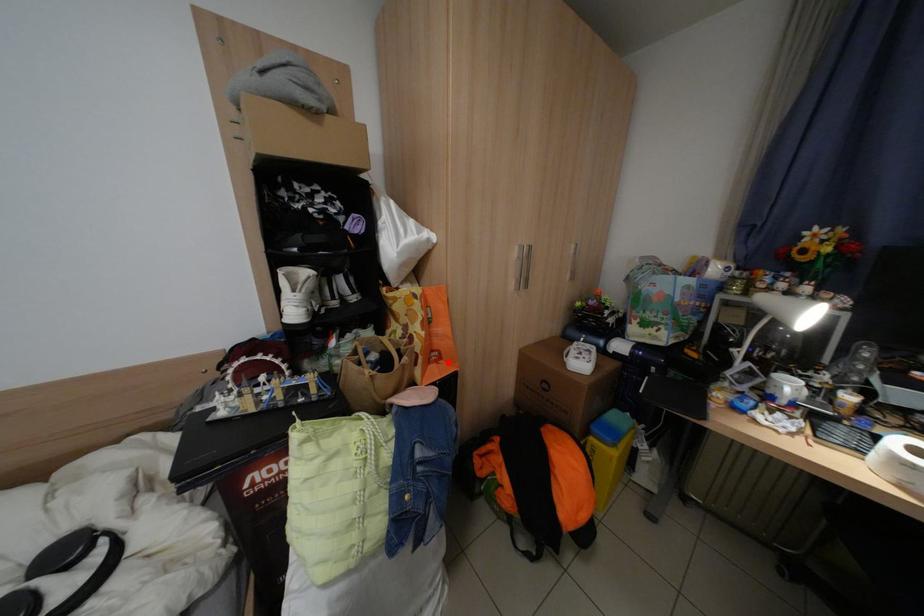
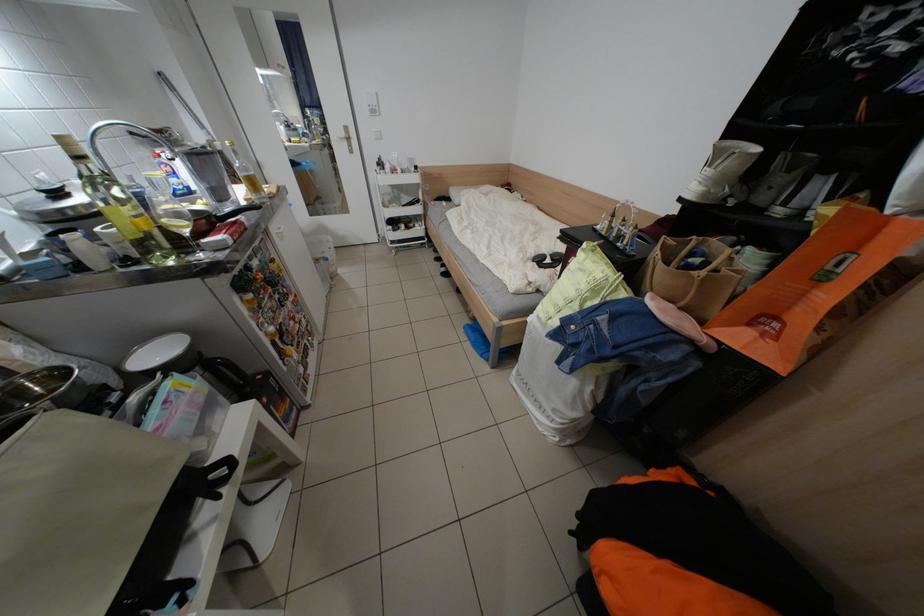
Find the pixel in the second image that matches the highlighted location in the first image.

(775, 334)